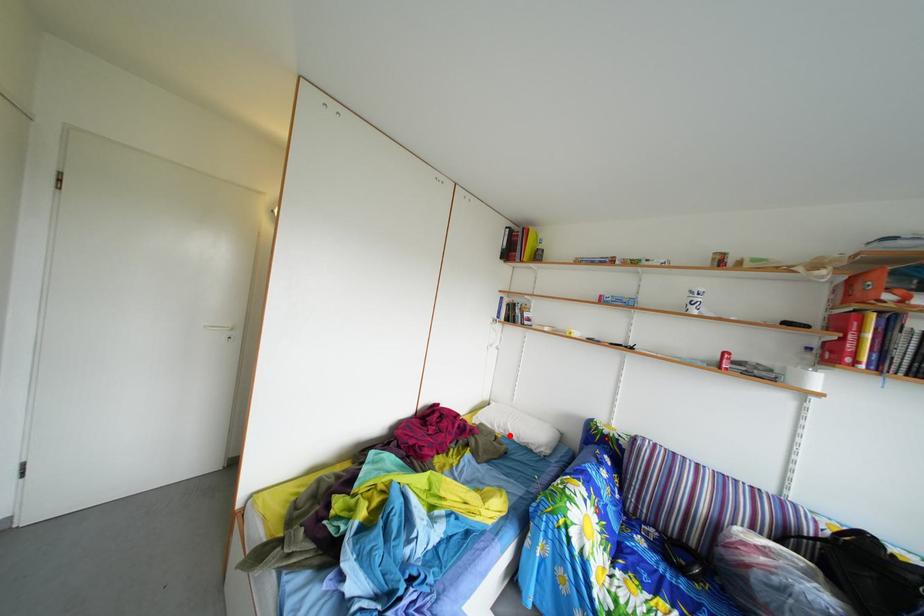
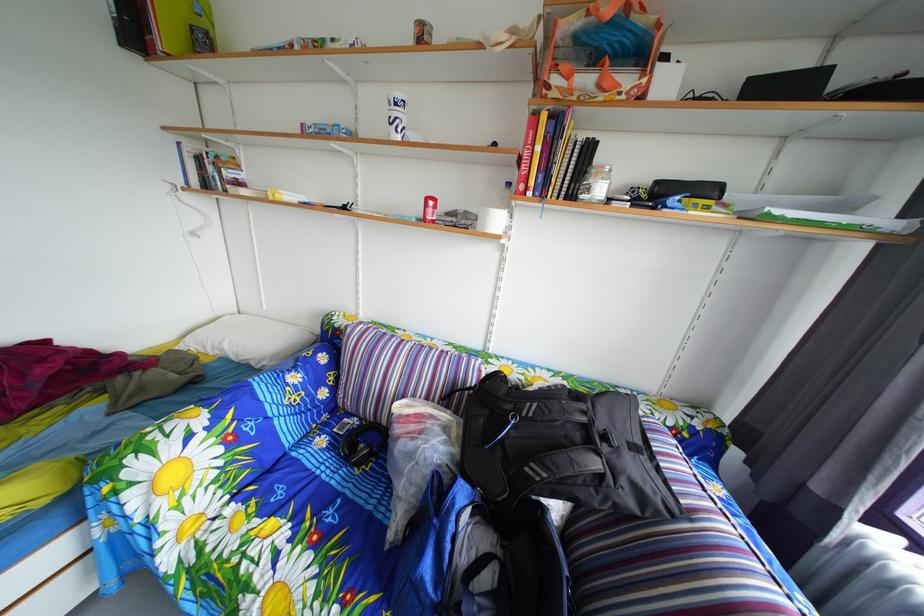
Locate, in the second image, the point that corresponds to the highlighted location in the first image.

(224, 357)